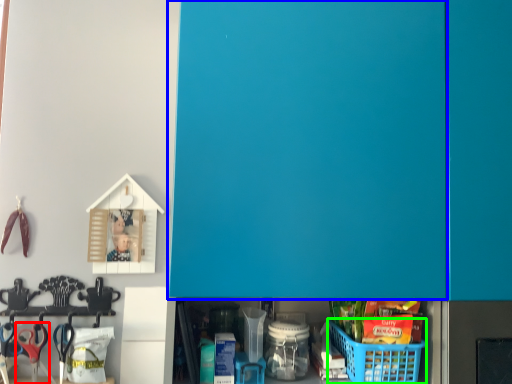
Question: Considering the real-world distances, which object is closest to scissors (highlighted by a red box)? door (highlighted by a blue box) or basket (highlighted by a green box).

Choices:
 (A) door
 (B) basket

Answer: (B)